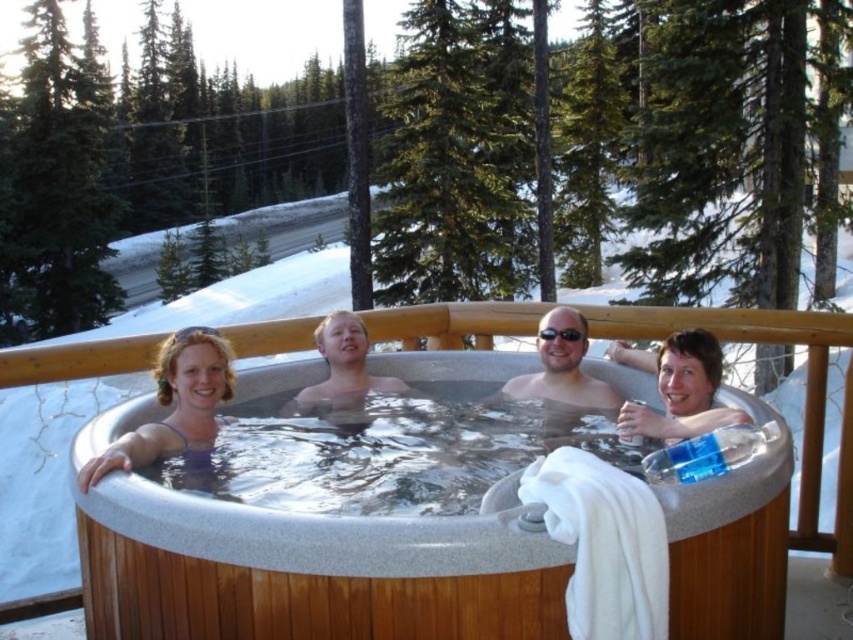
Question: Is matte plastic cup at upper right smaller than matte wood hot tub at center?

Choices:
 (A) yes
 (B) no

Answer: (B)

Question: In this image, where is gray wood hot tub at center located relative to black plastic goggles at center?

Choices:
 (A) left
 (B) right

Answer: (A)

Question: Considering the real-world distances, which object is farthest from the black plastic goggles at center?

Choices:
 (A) matte purple swimsuit at left
 (B) matte purple swimsuit at center
 (C) matte wood hot tub at center
 (D) matte plastic cup at upper right

Answer: (A)

Question: Estimate the real-world distances between objects in this image. Which object is closer to the matte purple swimsuit at center?

Choices:
 (A) matte wood hot tub at center
 (B) black plastic goggles at center

Answer: (A)

Question: Which point is closer to the camera?

Choices:
 (A) matte purple swimsuit at center
 (B) black plastic goggles at center
 (C) matte purple swimsuit at left
 (D) matte plastic cup at upper right

Answer: (C)

Question: Is gray wood hot tub at center closer to the viewer compared to matte plastic cup at upper right?

Choices:
 (A) no
 (B) yes

Answer: (B)